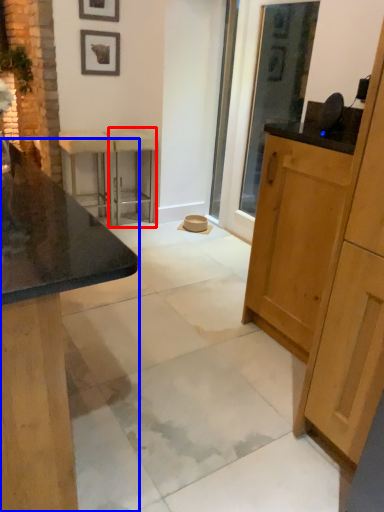
Question: Which point is further to the camera, bar stool (highlighted by a red box) or cabinetry (highlighted by a blue box)?

Choices:
 (A) bar stool
 (B) cabinetry

Answer: (A)